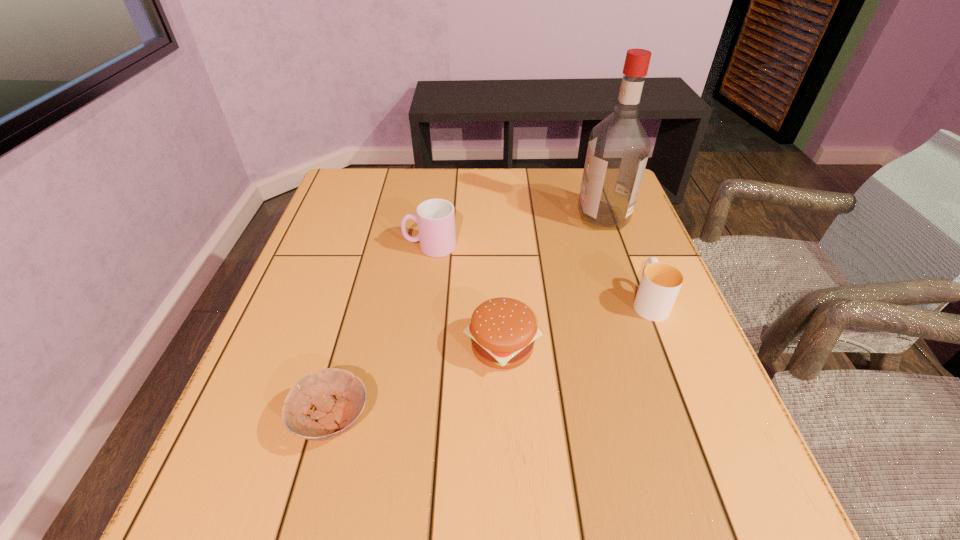
You are a GUI agent. You are given a task and a screenshot of the screen. Output one action in this format:
    pyautogui.click(x=<x>, y=<y>)
    Task: Click on the vacant position located on the front-facing side of the tallest object
    The width and height of the screenshot is (960, 540).
    Given the screenshot: What is the action you would take?
    pyautogui.click(x=553, y=217)

At what (x,y) coordinates should I click in order to perform the action: click on vacant space located on the front-facing side of the tallest object. Please return your answer as a coordinate pair (x, y). This screenshot has height=540, width=960. Looking at the image, I should click on [x=447, y=217].

Image resolution: width=960 pixels, height=540 pixels. Find the location of `vacant region located 0.090m with the handle on the side of the left cup`. vacant region located 0.090m with the handle on the side of the left cup is located at coordinates (367, 247).

You are a GUI agent. You are given a task and a screenshot of the screen. Output one action in this format:
    pyautogui.click(x=<x>, y=<y>)
    Task: Click on the vacant region located with the handle on the side of the left cup
    The height and width of the screenshot is (540, 960).
    Given the screenshot: What is the action you would take?
    pyautogui.click(x=318, y=247)

Where is `vacant space located 0.230m with the handle on the side of the left cup`? The width and height of the screenshot is (960, 540). vacant space located 0.230m with the handle on the side of the left cup is located at coordinates (310, 247).

Identify the location of vacant space located 0.340m with the handle on the side of the right cup. The image size is (960, 540). click(x=610, y=199).

Find the location of a particular element. vacant region located 0.300m with the handle on the side of the right cup is located at coordinates (612, 207).

Locate an element on the screen. vacant space located with the handle on the side of the right cup is located at coordinates 626,241.

Locate an element on the screen. vacant area situated on the front of the hamburger is located at coordinates (509, 501).

Identify the location of free location located on the right of the bowl. (579, 420).